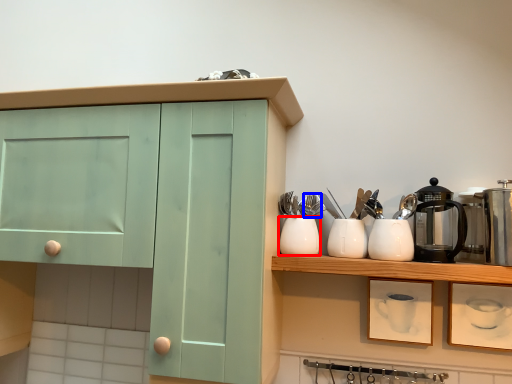
Question: Among these objects, which one is nearest to the camera, tableware (highlighted by a red box) or silverware (highlighted by a blue box)?

Choices:
 (A) tableware
 (B) silverware

Answer: (A)